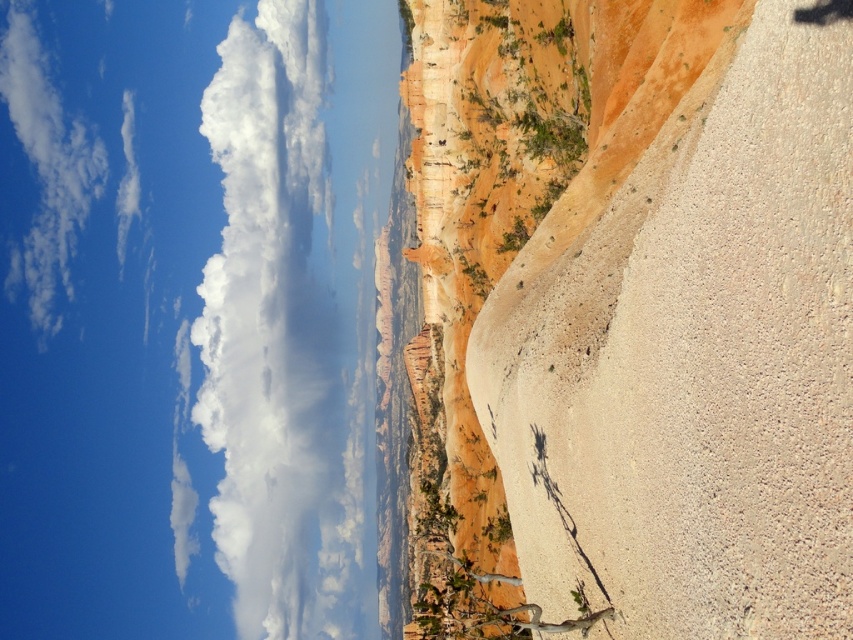
You are an explorer standing on the rugged terrain in the foreground. You see the rustic sandstone cliff at right and the white fluffy cloud at upper left. Which object is closer to you?

The rustic sandstone cliff at right is closer to you because it is positioned over the white fluffy cloud at upper left, indicating it is in front of the cloud.

You are a hiker standing at the base of the rustic sandstone cliff at right and want to reach the white fluffy cloud at upper left. Is it possible to physically reach the cloud from the cliff within a 200 meter radius?

The distance between rustic sandstone cliff at right and white fluffy cloud at upper left is 148.54 meters, so yes, it is possible to reach the cloud within a 200 meter radius as the distance is less than 200 meters.

You are an artist planning to paint this landscape. You want to ensure the rustic sandstone cliff at right and the white fluffy cloud at upper left are positioned correctly according to their spatial relationship. Which object should you paint first to maintain depth perception?

You should paint the rustic sandstone cliff at right first because it is in front of the white fluffy cloud at upper left, so painting it first will help establish the correct spatial relationship and depth perception.